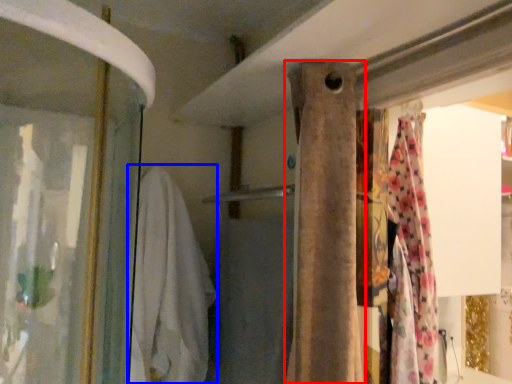
Question: Which object is closer to the camera taking this photo, curtain (highlighted by a red box) or clothing (highlighted by a blue box)?

Choices:
 (A) curtain
 (B) clothing

Answer: (A)